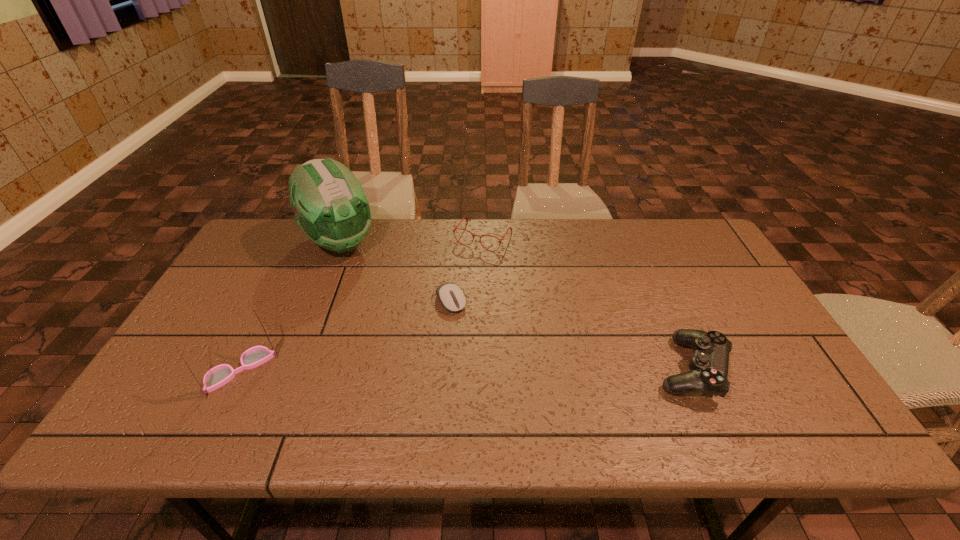
I want to click on football helmet present at the far edge, so click(x=331, y=207).

Find the location of a particular element. This screenshot has height=540, width=960. spectacles present at the far edge is located at coordinates (455, 228).

Where is `spectacles that is at the near edge`? Image resolution: width=960 pixels, height=540 pixels. spectacles that is at the near edge is located at coordinates (218, 376).

Find the location of `control present at the near edge`. control present at the near edge is located at coordinates (708, 372).

You are a GUI agent. You are given a task and a screenshot of the screen. Output one action in this format:
    pyautogui.click(x=<x>, y=<y>)
    Task: Click on the object that is positioned at the left edge
    
    Given the screenshot: What is the action you would take?
    pyautogui.click(x=218, y=376)

Where is `object that is positioned at the right edge`? This screenshot has width=960, height=540. object that is positioned at the right edge is located at coordinates (708, 372).

Identify the location of object at the near left corner. The width and height of the screenshot is (960, 540). (218, 376).

The image size is (960, 540). What are the coordinates of `object present at the near right corner` in the screenshot? It's located at tap(708, 372).

Image resolution: width=960 pixels, height=540 pixels. I want to click on vacant space at the far edge of the desktop, so click(x=313, y=253).

Locate an element on the screen. The width and height of the screenshot is (960, 540). vacant region at the near edge of the desktop is located at coordinates (505, 394).